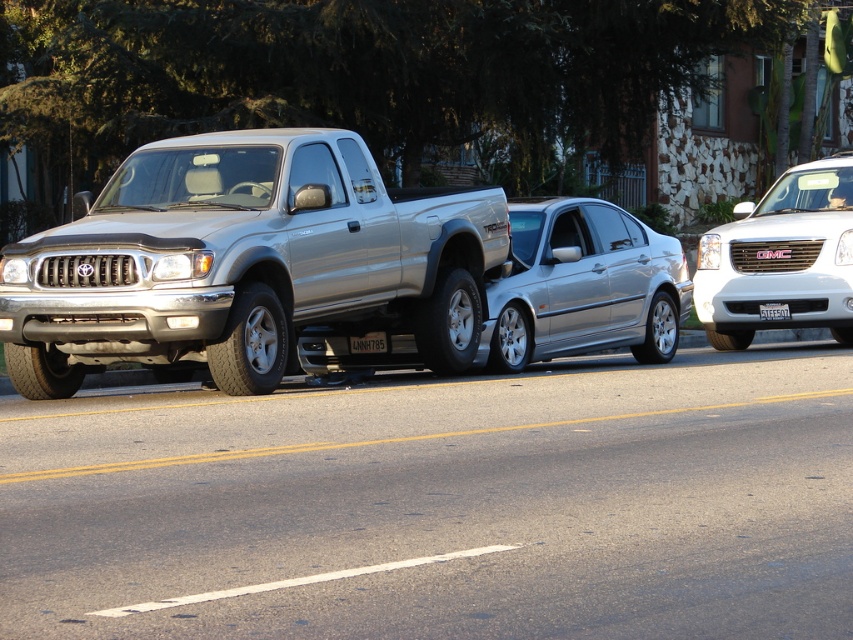
Question: Considering the real-world distances, which object is farthest from the white plastic license plate at center?

Choices:
 (A) silver metallic truck at center
 (B) white glossy suv at upper right

Answer: (A)

Question: Can you confirm if silver metallic truck at center is positioned to the left of white plastic license plate at center?

Choices:
 (A) no
 (B) yes

Answer: (B)

Question: Which object is positioned closest to the white plastic license plate at center?

Choices:
 (A) white glossy suv at upper right
 (B) black plastic license plate at center
 (C) silver metallic truck at center

Answer: (A)

Question: Where is white glossy suv at upper right located in relation to white plastic license plate at center in the image?

Choices:
 (A) above
 (B) below

Answer: (A)

Question: Which point is closer to the camera?

Choices:
 (A) white glossy suv at upper right
 (B) black plastic license plate at center
 (C) silver metallic truck at center

Answer: (C)

Question: Does silver metallic truck at center have a lesser width compared to black plastic license plate at center?

Choices:
 (A) yes
 (B) no

Answer: (B)